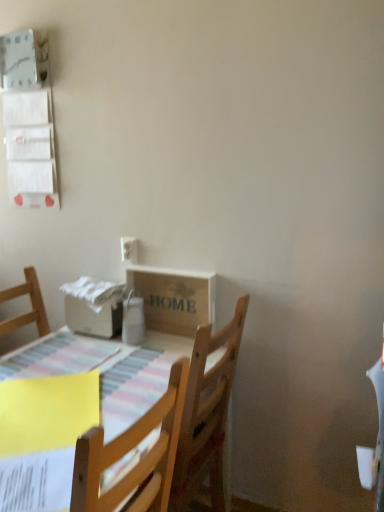
Identify the location of blank space above wooden crate at center (from a real-world perspective). The width and height of the screenshot is (384, 512). (170, 268).